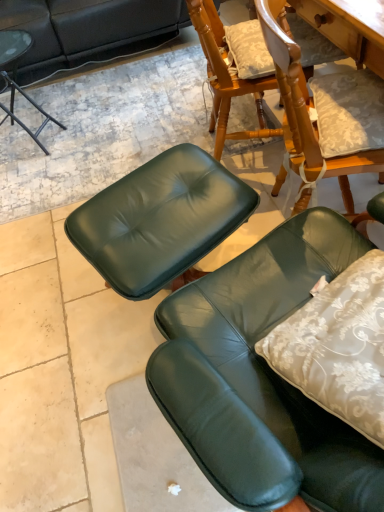
In order to click on vacant space to the right of matte black side table at upper left, marked as the second chair in a right-to-left arrangement in this screenshot , I will do `click(97, 119)`.